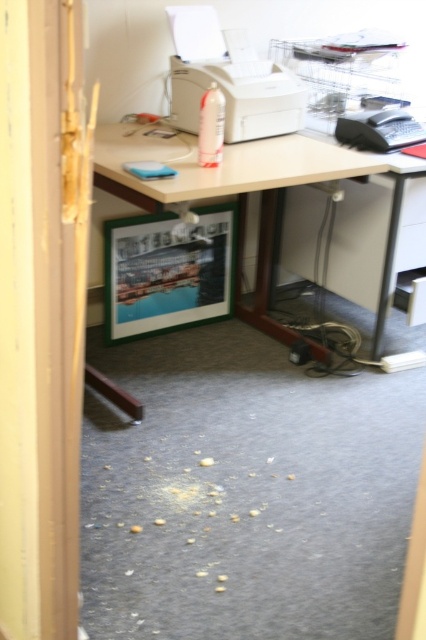
What are the coordinates of the wooden desk at center?

The wooden desk at center is located at coordinates [226,180].

You are standing in the doorway of the office. Where is the white plastic printer at center located in relation to the desk?

The white plastic printer at center is located at the center of the desk.

You are a delivery person who needs to place a 16 inch wide package on the desk between the white plastic printer at center and the black plastic telephone at right. Is there enough space?

The distance between the white plastic printer at center and the black plastic telephone at right is 18.34 inches, so there is enough space to place a 16 inch wide package between them.